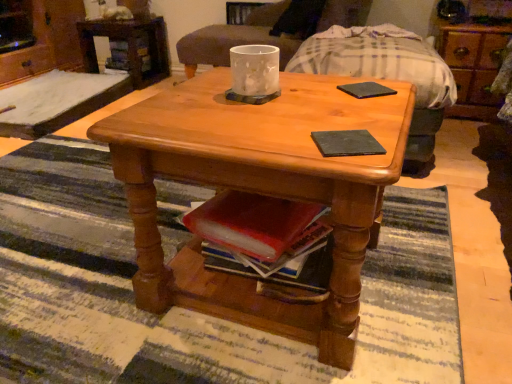
Image resolution: width=512 pixels, height=384 pixels. In order to click on free location to the left of black matte pad at center, the 1th pad when ordered from top to bottom in this screenshot , I will do tap(307, 93).